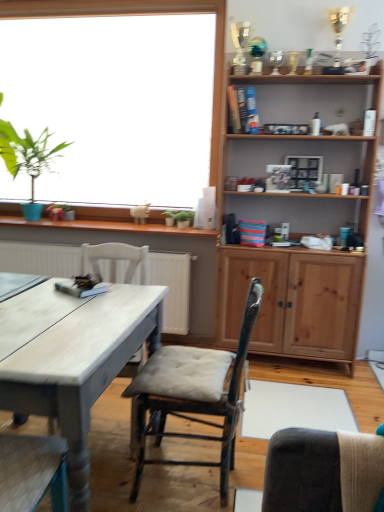
Question: Does green leafy plant at upper left have a lesser height compared to wooden cabinet at upper right?

Choices:
 (A) yes
 (B) no

Answer: (A)

Question: Considering the relative sizes of green leafy plant at upper left and wooden cabinet at upper right in the image provided, is green leafy plant at upper left taller than wooden cabinet at upper right?

Choices:
 (A) no
 (B) yes

Answer: (A)

Question: Is green leafy plant at upper left closer to camera compared to wooden cabinet at upper right?

Choices:
 (A) yes
 (B) no

Answer: (B)

Question: Is green leafy plant at upper left behind wooden cabinet at upper right?

Choices:
 (A) no
 (B) yes

Answer: (B)

Question: Is green leafy plant at upper left outside wooden cabinet at upper right?

Choices:
 (A) yes
 (B) no

Answer: (A)

Question: Considering the positions of wooden cabinet at upper right and wooden cushioned chair at center, which is the 1th chair in right-to-left order, in the image, is wooden cabinet at upper right bigger or smaller than wooden cushioned chair at center, which is the 1th chair in right-to-left order,?

Choices:
 (A) big
 (B) small

Answer: (A)

Question: In the image, is wooden cabinet at upper right on the left side or the right side of wooden cushioned chair at center, which is the 1th chair in right-to-left order?

Choices:
 (A) left
 (B) right

Answer: (B)

Question: From the image's perspective, is wooden cabinet at upper right above or below wooden cushioned chair at center, which is the 1th chair in right-to-left order?

Choices:
 (A) below
 (B) above

Answer: (B)

Question: Does point (264, 304) appear closer or farther from the camera than point (178, 386)?

Choices:
 (A) closer
 (B) farther

Answer: (B)

Question: Is wooden cushioned chair at center, which is the 1th chair in right-to-left order, in front of or behind green leafy plant at upper left in the image?

Choices:
 (A) behind
 (B) front

Answer: (B)

Question: Based on their sizes in the image, would you say wooden cushioned chair at center, which is the 1th chair in right-to-left order, is bigger or smaller than green leafy plant at upper left?

Choices:
 (A) big
 (B) small

Answer: (B)

Question: Considering the positions of wooden cushioned chair at center, positioned as the 2th chair in left-to-right order, and green leafy plant at upper left in the image, is wooden cushioned chair at center, positioned as the 2th chair in left-to-right order, wider or thinner than green leafy plant at upper left?

Choices:
 (A) wide
 (B) thin

Answer: (A)

Question: From their relative heights in the image, would you say wooden cushioned chair at center, which is the 1th chair in right-to-left order, is taller or shorter than green leafy plant at upper left?

Choices:
 (A) tall
 (B) short

Answer: (B)

Question: Considering the relative positions of white painted wood desk at left and green leafy plant at upper left in the image provided, is white painted wood desk at left to the left or to the right of green leafy plant at upper left?

Choices:
 (A) right
 (B) left

Answer: (A)

Question: Considering the positions of point (158, 329) and point (13, 166), is point (158, 329) closer or farther from the camera than point (13, 166)?

Choices:
 (A) farther
 (B) closer

Answer: (B)